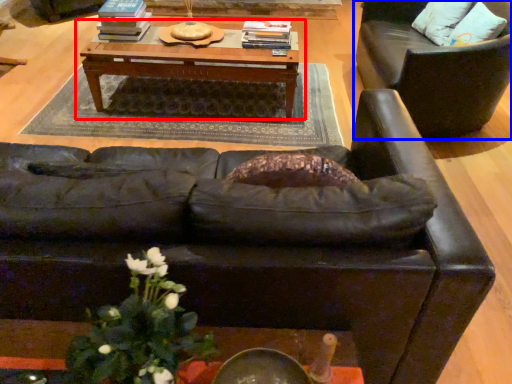
Question: Which object appears closest to the camera in this image, table (highlighted by a red box) or chair (highlighted by a blue box)?

Choices:
 (A) table
 (B) chair

Answer: (B)